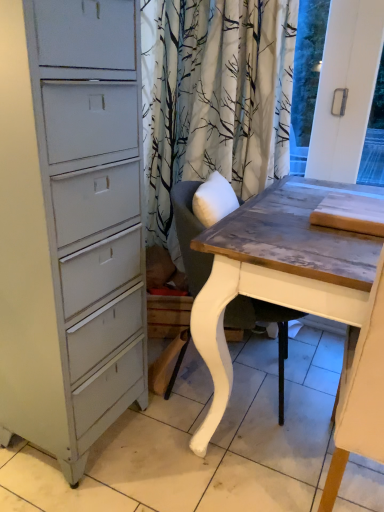
Locate an element on the screen. free space in front of white painted wood chair at center is located at coordinates (206, 468).